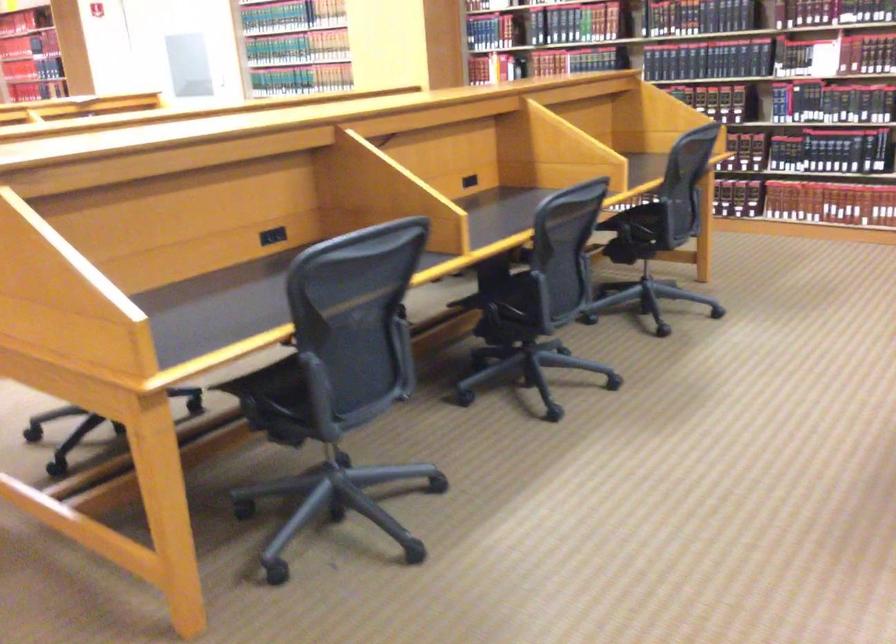
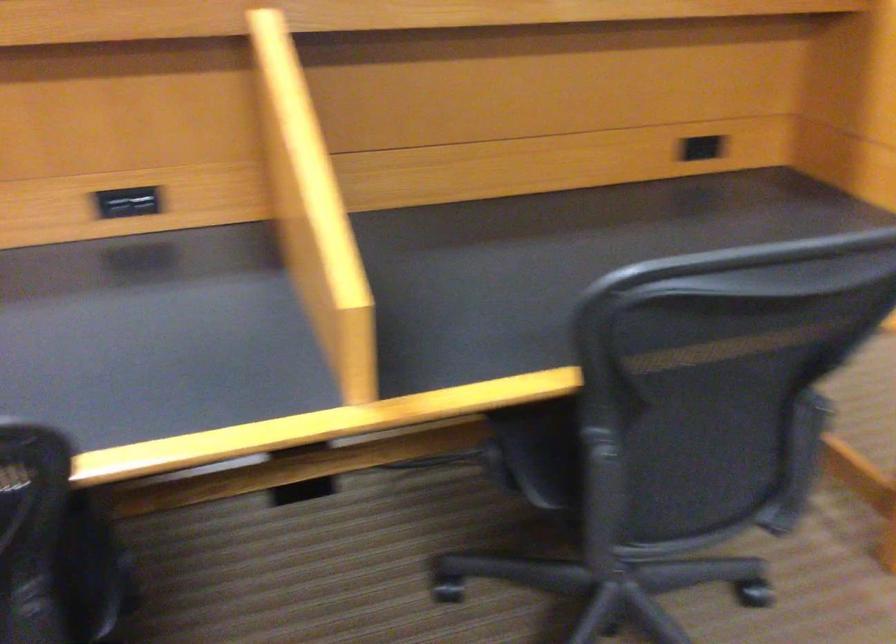
Find the pixel in the second image that matches point 469,167 in the first image.

(123, 205)